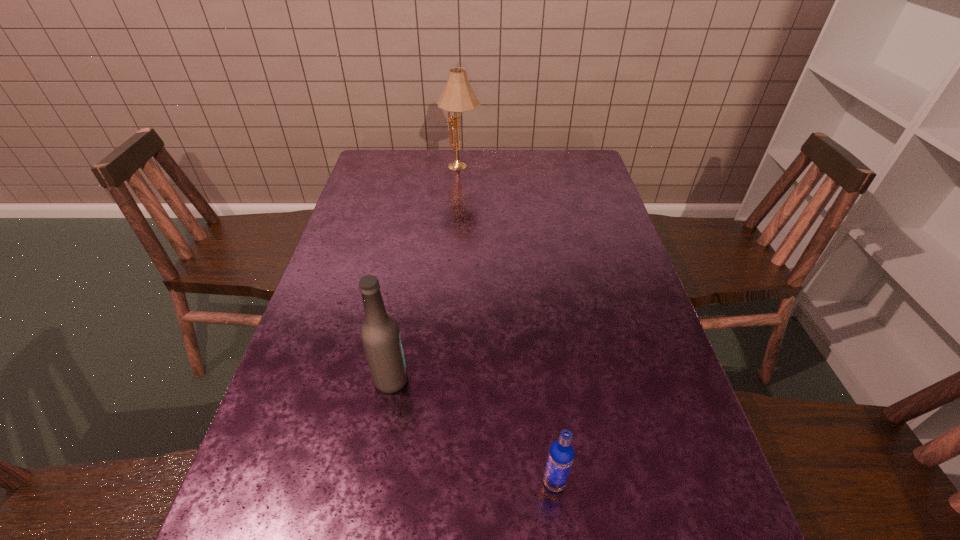
At what (x,y) coordinates should I click in order to perform the action: click on vacant space that satisfies the following two spatial constraints: 1. on the label of the beer bottle; 2. on the left side of the shortest object. Please return your answer as a coordinate pair (x, y). Looking at the image, I should click on (373, 482).